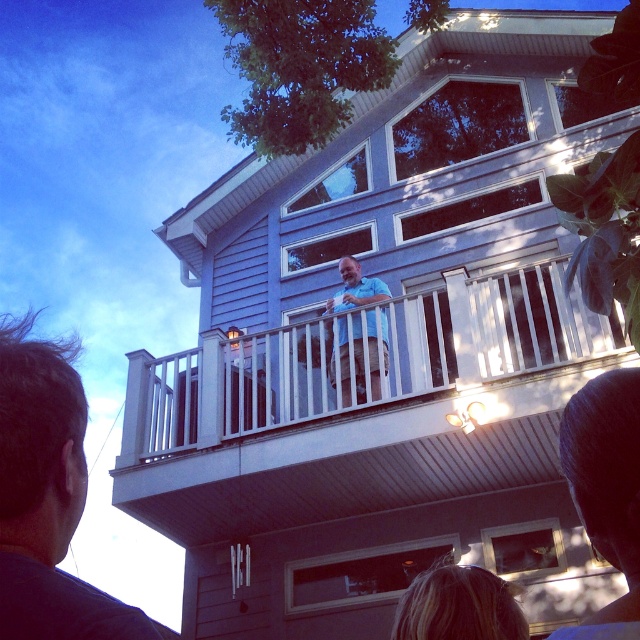
This screenshot has width=640, height=640. What do you see at coordinates (458, 605) in the screenshot? I see `blonde hair at lower center` at bounding box center [458, 605].

This screenshot has height=640, width=640. What are the coordinates of `blonde hair at lower center` in the screenshot? It's located at (458, 605).

Which is below, dark brown hair at upper right or blonde hair at lower center?

blonde hair at lower center is below.

Is dark brown hair at upper right smaller than blonde hair at lower center?

No.

Which is in front, point (596, 387) or point (456, 616)?

Point (596, 387) is more forward.

You are a GUI agent. You are given a task and a screenshot of the screen. Output one action in this format:
    pyautogui.click(x=<x>, y=<y>)
    Task: Click on the dark brown hair at upper right
    The image size is (640, 640).
    Given the screenshot: What is the action you would take?
    pyautogui.click(x=605, y=490)

Can you confirm if dark brown hair at upper left is positioned below light blue shirt at upper center?

Yes.

Is point (58, 604) less distant than point (380, 292)?

Yes, point (58, 604) is closer to viewer.

In order to click on dark brown hair at upper left in this screenshot , I will do 45,497.